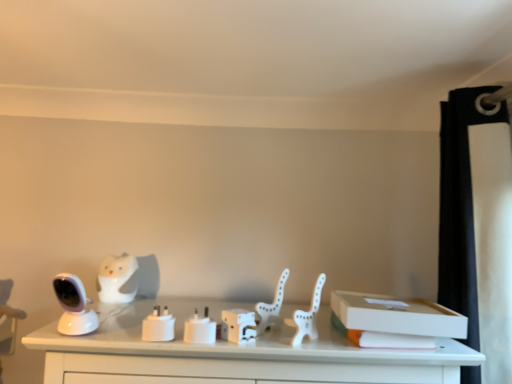
Question: Is white matte plastic chair at center to the right of white plastic animal at center, the first animal positioned from the front, from the viewer's perspective?

Choices:
 (A) no
 (B) yes

Answer: (B)

Question: Is white matte plastic chair at center located outside white plastic animal at center, the 2th animal when ordered from back to front?

Choices:
 (A) no
 (B) yes

Answer: (B)

Question: Is white matte plastic chair at center smaller than white plastic animal at center, the first animal positioned from the front?

Choices:
 (A) no
 (B) yes

Answer: (A)

Question: From a real-world perspective, is white matte plastic chair at center under white plastic animal at center, the 2th animal when ordered from back to front?

Choices:
 (A) yes
 (B) no

Answer: (A)

Question: From a real-world perspective, is white matte plastic chair at center on top of white plastic animal at center, the 2th animal when ordered from back to front?

Choices:
 (A) no
 (B) yes

Answer: (A)

Question: In the image, is white plastic animal at center, the first animal positioned from the front, positioned in front of or behind white matte plastic chair at center?

Choices:
 (A) behind
 (B) front

Answer: (A)

Question: Choose the correct answer: Is white plastic animal at center, the 2th animal viewed from the left, inside white matte plastic chair at center or outside it?

Choices:
 (A) inside
 (B) outside

Answer: (B)

Question: From the image's perspective, is white plastic animal at center, the first animal positioned from the front, positioned above or below white matte plastic chair at center?

Choices:
 (A) below
 (B) above

Answer: (B)

Question: Considering the positions of white plastic animal at center, the first animal positioned from the front, and white matte plastic chair at center in the image, is white plastic animal at center, the first animal positioned from the front, bigger or smaller than white matte plastic chair at center?

Choices:
 (A) big
 (B) small

Answer: (B)

Question: Is white matte plug at center wider or thinner than white matte plastic chair at center?

Choices:
 (A) wide
 (B) thin

Answer: (B)

Question: In terms of size, does white matte plug at center appear bigger or smaller than white matte plastic chair at center?

Choices:
 (A) big
 (B) small

Answer: (B)

Question: From a real-world perspective, is white matte plug at center physically located above or below white matte plastic chair at center?

Choices:
 (A) below
 (B) above

Answer: (A)

Question: Which is correct: white matte plug at center is inside white matte plastic chair at center, or outside of it?

Choices:
 (A) outside
 (B) inside

Answer: (A)

Question: Is point (321, 289) closer or farther from the camera than point (117, 274)?

Choices:
 (A) closer
 (B) farther

Answer: (A)

Question: In terms of height, does white matte plastic chair at center look taller or shorter compared to white matte owl at left, the 1th animal in the back-to-front sequence?

Choices:
 (A) short
 (B) tall

Answer: (B)